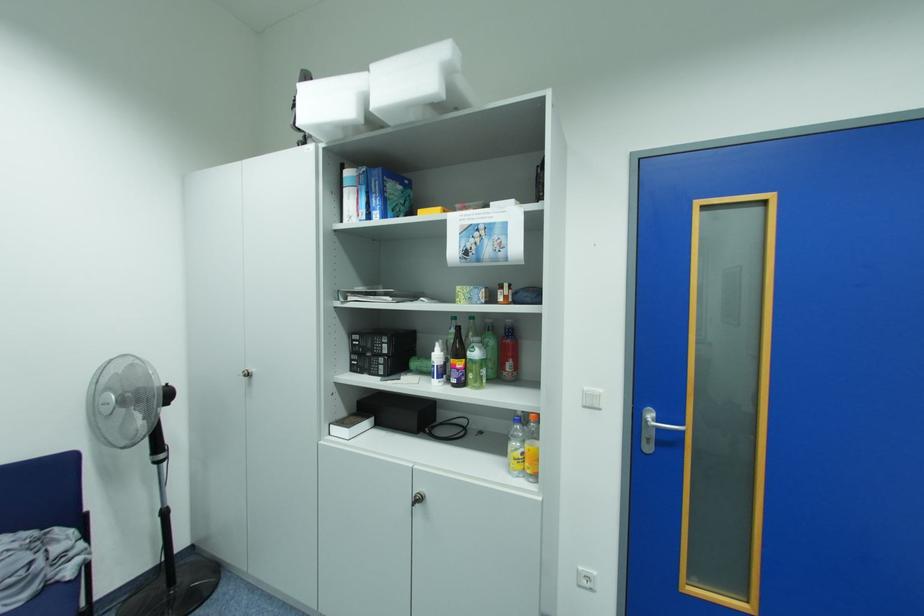
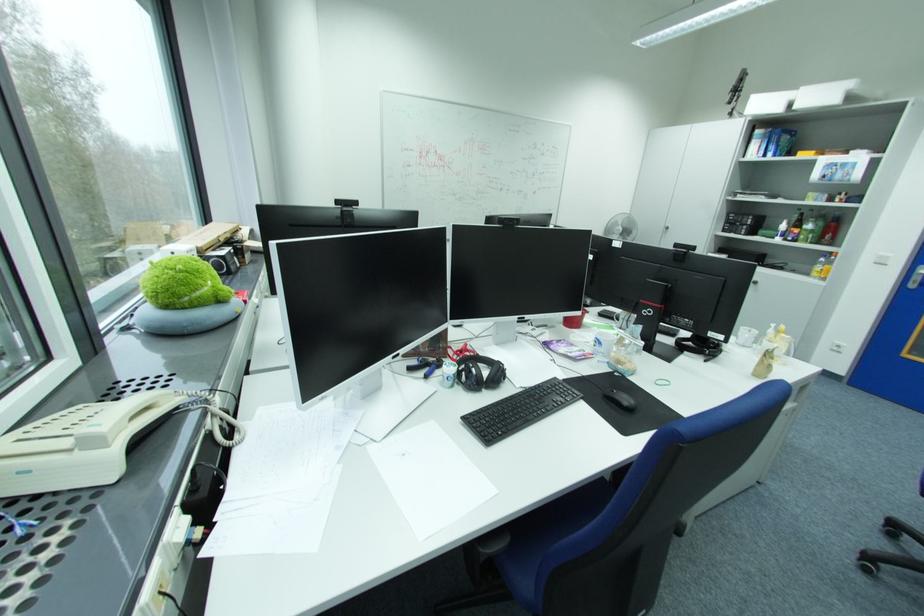
In the second image, find the point that corresponds to the point at 428,500 in the first image.

(763, 283)